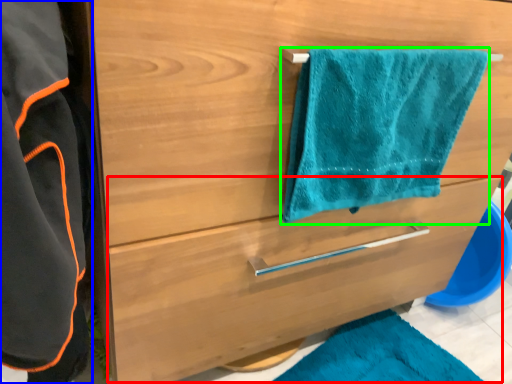
Question: Based on their relative distances, which object is nearer to drawer (highlighted by a red box)? Choose from bathrobe (highlighted by a blue box) and towel/napkin (highlighted by a green box).

Choices:
 (A) bathrobe
 (B) towel/napkin

Answer: (B)